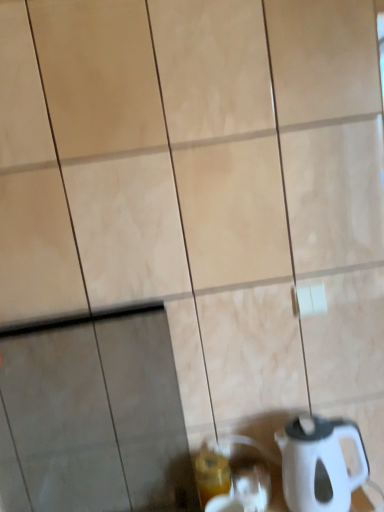
Question: In terms of width, does white plastic kettle at lower right look wider or thinner when compared to translucent glass beverage at lower center?

Choices:
 (A) thin
 (B) wide

Answer: (B)

Question: Considering the positions of point (347, 472) and point (200, 504), is point (347, 472) closer or farther from the camera than point (200, 504)?

Choices:
 (A) farther
 (B) closer

Answer: (B)

Question: From the image's perspective, is white plastic kettle at lower right positioned above or below translucent glass beverage at lower center?

Choices:
 (A) below
 (B) above

Answer: (B)

Question: Considering the positions of point (208, 464) and point (292, 480), is point (208, 464) closer or farther from the camera than point (292, 480)?

Choices:
 (A) closer
 (B) farther

Answer: (B)

Question: From the image's perspective, is translucent glass beverage at lower center located above or below white plastic kettle at lower right?

Choices:
 (A) above
 (B) below

Answer: (B)

Question: Do you think translucent glass beverage at lower center is within white plastic kettle at lower right, or outside of it?

Choices:
 (A) inside
 (B) outside

Answer: (B)

Question: From their relative heights in the image, would you say translucent glass beverage at lower center is taller or shorter than white plastic kettle at lower right?

Choices:
 (A) short
 (B) tall

Answer: (A)